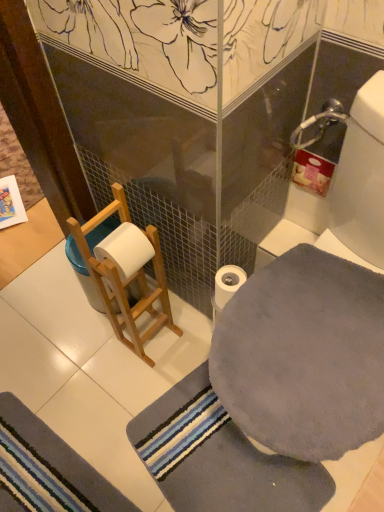
Question: Would you say gray soft bath towel at lower right, arranged as the first bath towel when ordered from the bottom, is outside white matte toilet paper at center?

Choices:
 (A) no
 (B) yes

Answer: (B)

Question: From the image's perspective, does gray soft bath towel at lower right, arranged as the first bath towel when ordered from the bottom, appear higher than white matte toilet paper at center?

Choices:
 (A) yes
 (B) no

Answer: (B)

Question: From the image's perspective, is gray soft bath towel at lower right, positioned as the 2th bath towel in top-to-bottom order, located beneath white matte toilet paper at center?

Choices:
 (A) yes
 (B) no

Answer: (A)

Question: Is gray soft bath towel at lower right, arranged as the first bath towel when ordered from the bottom, not close to white matte toilet paper at center?

Choices:
 (A) yes
 (B) no

Answer: (B)

Question: Is the depth of gray soft bath towel at lower right, arranged as the first bath towel when ordered from the bottom, greater than that of white matte toilet paper at center?

Choices:
 (A) no
 (B) yes

Answer: (A)

Question: In terms of height, does wooden ladder at left look taller or shorter compared to gray soft bath towel at right, which is the 1th bath towel from top to bottom?

Choices:
 (A) tall
 (B) short

Answer: (A)

Question: Is wooden ladder at left to the left or to the right of gray soft bath towel at right, marked as the second bath towel in a bottom-to-top arrangement, in the image?

Choices:
 (A) right
 (B) left

Answer: (B)

Question: Is point (139, 244) positioned closer to the camera than point (327, 448)?

Choices:
 (A) farther
 (B) closer

Answer: (A)

Question: Considering the positions of wooden ladder at left and gray soft bath towel at right, marked as the second bath towel in a bottom-to-top arrangement, in the image, is wooden ladder at left wider or thinner than gray soft bath towel at right, marked as the second bath towel in a bottom-to-top arrangement,?

Choices:
 (A) wide
 (B) thin

Answer: (B)

Question: In terms of height, does gray plush bath mat at lower left look taller or shorter compared to wooden ladder at left?

Choices:
 (A) tall
 (B) short

Answer: (B)

Question: Is point (9, 457) positioned closer to the camera than point (119, 184)?

Choices:
 (A) closer
 (B) farther

Answer: (B)

Question: Looking at the image, does gray plush bath mat at lower left seem bigger or smaller compared to wooden ladder at left?

Choices:
 (A) small
 (B) big

Answer: (A)

Question: Is gray plush bath mat at lower left inside or outside of wooden ladder at left?

Choices:
 (A) inside
 (B) outside

Answer: (B)

Question: Considering the positions of white matte toilet paper at center and gray plush bath mat at lower left in the image, is white matte toilet paper at center taller or shorter than gray plush bath mat at lower left?

Choices:
 (A) tall
 (B) short

Answer: (A)

Question: From the image's perspective, relative to gray plush bath mat at lower left, is white matte toilet paper at center above or below?

Choices:
 (A) below
 (B) above

Answer: (B)